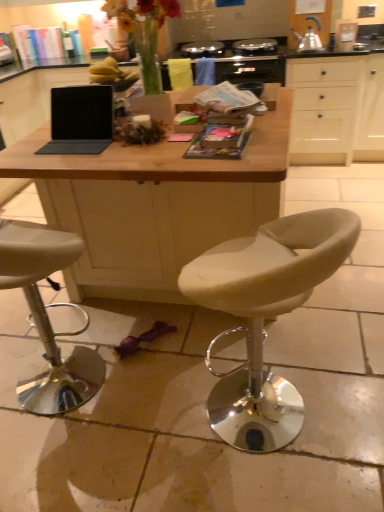
Locate an element on the screen. The height and width of the screenshot is (512, 384). vacant area that lies to the right of beige leather stool at lower left, the first chair from the left is located at coordinates (160, 388).